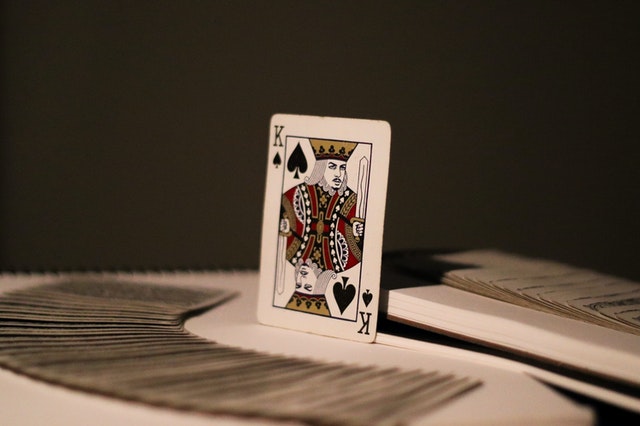
You are a GUI agent. You are given a task and a screenshot of the screen. Output one action in this format:
    pyautogui.click(x=<x>, y=<y>)
    Task: Click on the gap between tables
    The image size is (640, 426).
    Given the screenshot: What is the action you would take?
    pos(424,330)